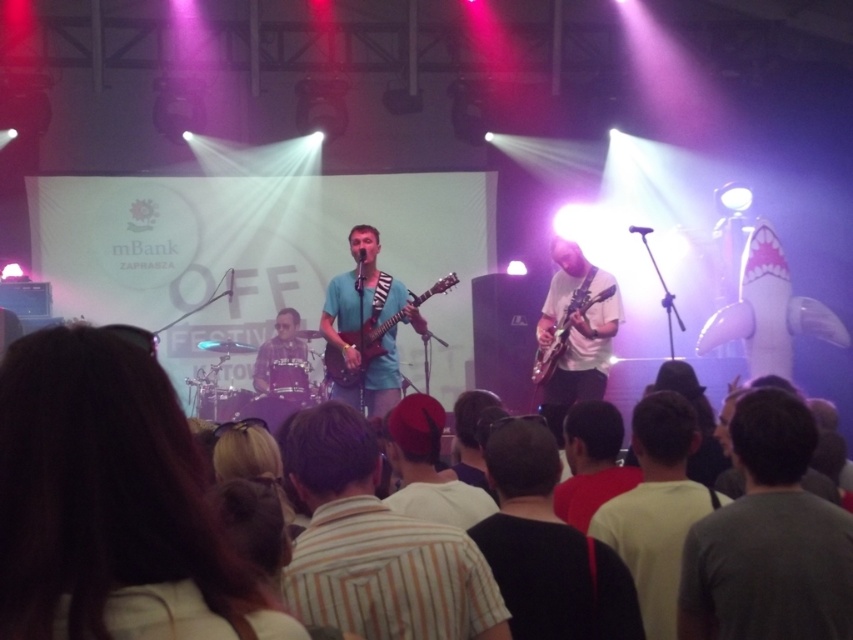
You are a photographer at the music festival and want to capture a closeup shot of the brown hair at center and the glossy wood guitar at center. Which object should you zoom in on to ensure it fills more of the frame without moving the camera?

The glossy wood guitar at center is thicker than the brown hair at center, so zooming in on the glossy wood guitar at center will fill the frame more.

You are a photographer standing at the back of the stage. You want to take a photo that includes both the red shirt at center and the glossy wood guitar at center. Given that your camera has a minimum focus distance of 8 feet, will you be able to capture both objects clearly in the same frame?

The red shirt at center and glossy wood guitar at center are 9.01 feet apart from each other. Since the minimum focus distance is 8 feet, the camera can focus on both objects as they are within the required distance. Therefore, you can capture both clearly in the same frame.

You are a stagehand who needs to move a 10 feet long ladder from the gray cotton shirt at center to the white matte guitar at center. Can you move the ladder horizontally between them without tilting it?

The distance between the gray cotton shirt at center and the white matte guitar at center is 11.81 feet, which is greater than the ladder length of 10 feet. Therefore, the ladder cannot be moved horizontally between them without tilting.